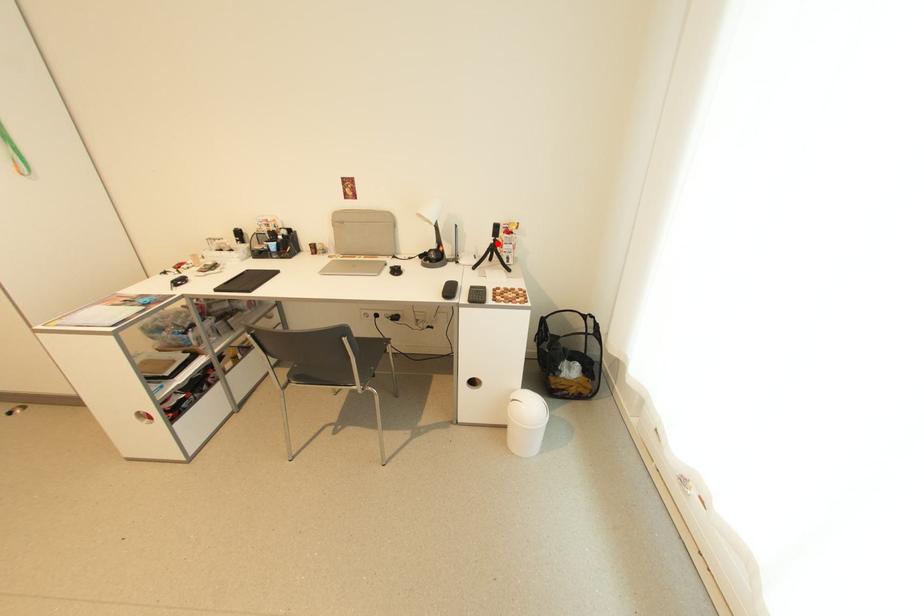
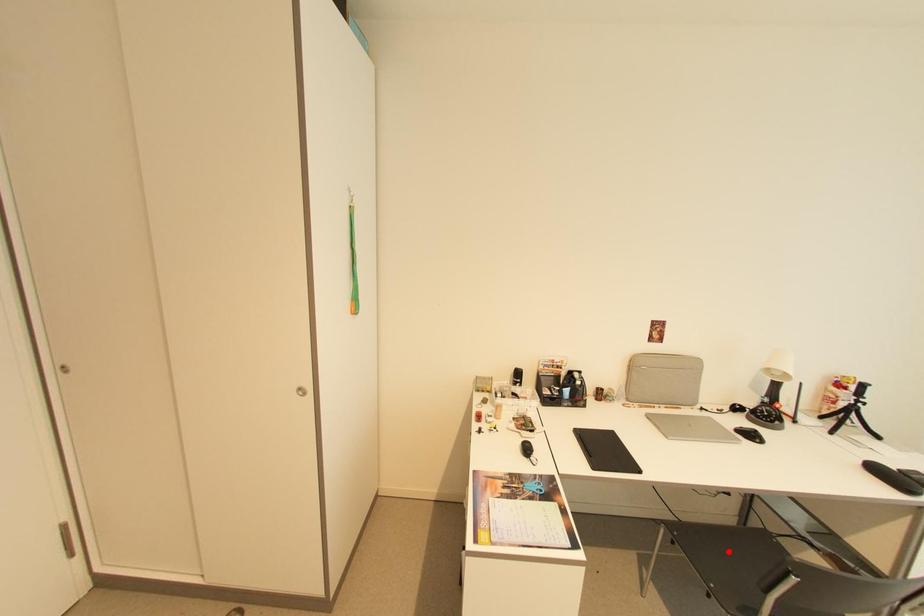
I am providing you with two images of the same scene from different viewpoints. A red point is marked on the first image and another point is marked on the second image. Is the red point in image1 aligned with the point shown in image2?

No